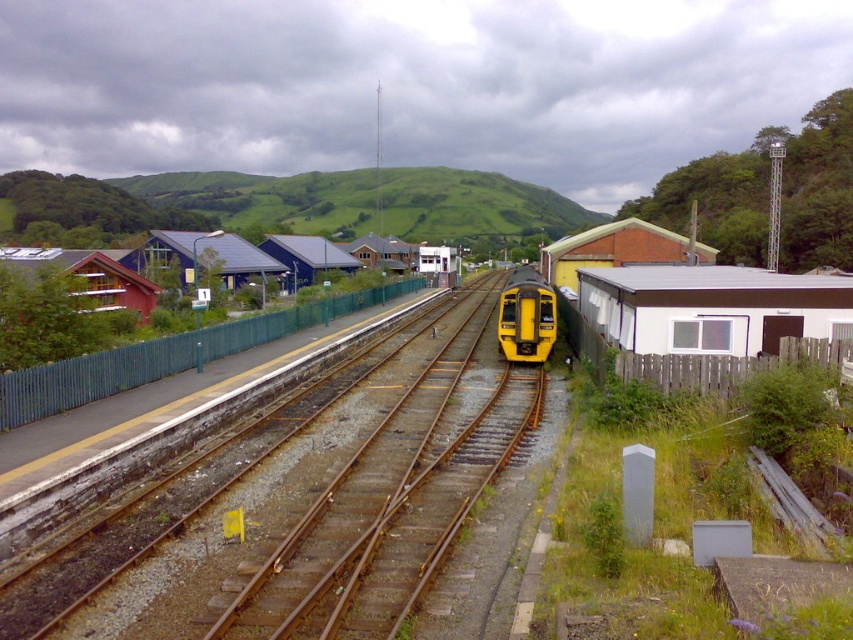
Who is lower down, metal tracks at center or yellow matte train at center?

metal tracks at center is lower down.

Does metal tracks at center have a greater height compared to yellow matte train at center?

No, metal tracks at center is not taller than yellow matte train at center.

Which is in front, point (271, 636) or point (509, 342)?

Point (271, 636) is more forward.

Identify the location of metal tracks at center. Image resolution: width=853 pixels, height=640 pixels. (297, 500).